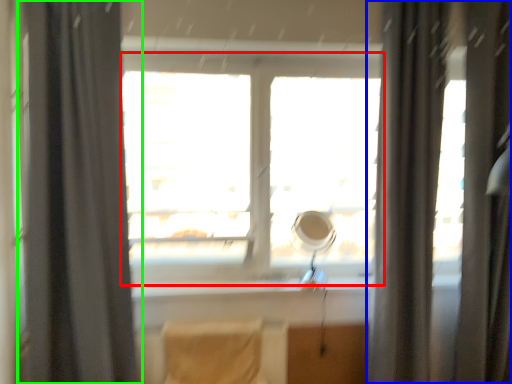
Question: Which object is positioned farthest from window (highlighted by a red box)? Select from curtain (highlighted by a blue box) and curtain (highlighted by a green box).

Choices:
 (A) curtain
 (B) curtain

Answer: (B)